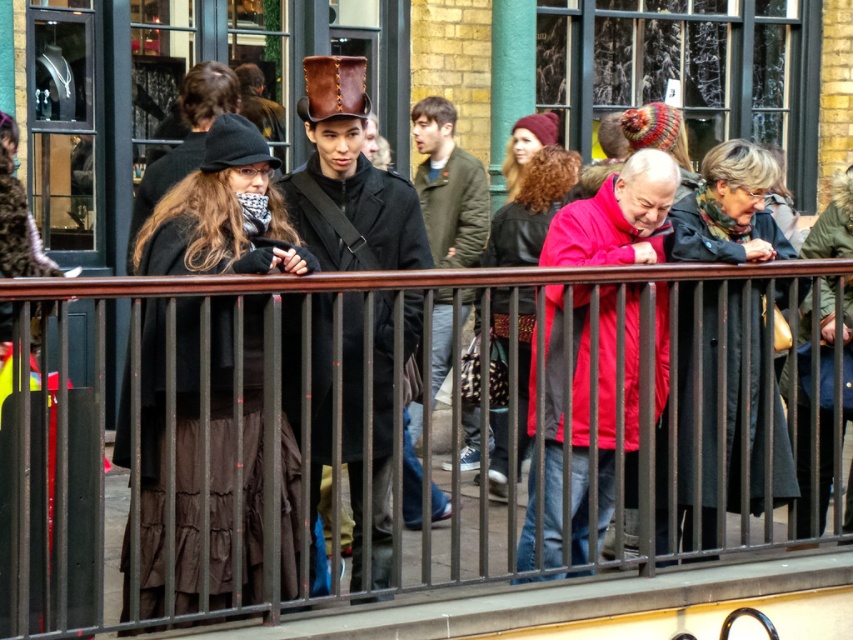
You are a photographer wanting to capture a closeup of the matte black coat at center and the leather hat at center. Since your camera has a limited focus range, you need to know which object is wider. Which one is wider?

The matte black coat at center is wider than the leather hat at center according to the description.

You are a photographer positioned behind the black metal railing in the scene. You want to take a photo of the matte black coat at center and the leather hat at center. However, you notice that one of the objects is blocking the view of the other. Which object is blocking the other?

The matte black coat at center is blocking the view of the leather hat at center because it is positioned in front of it.

You are a photographer trying to capture a photo of the matte black coat at center and the red matte jacket at center in the same frame. Which one will appear larger in the photo?

The matte black coat at center will appear larger in the photo because it is much taller than the red matte jacket at center.